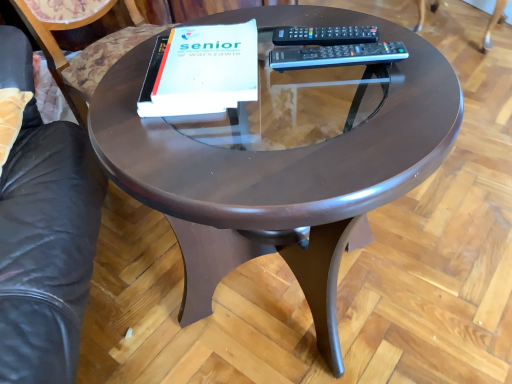
Locate an element on the screen. The height and width of the screenshot is (384, 512). vacant space in front of black plastic remote at upper right, the second remote viewed from the front is located at coordinates (389, 92).